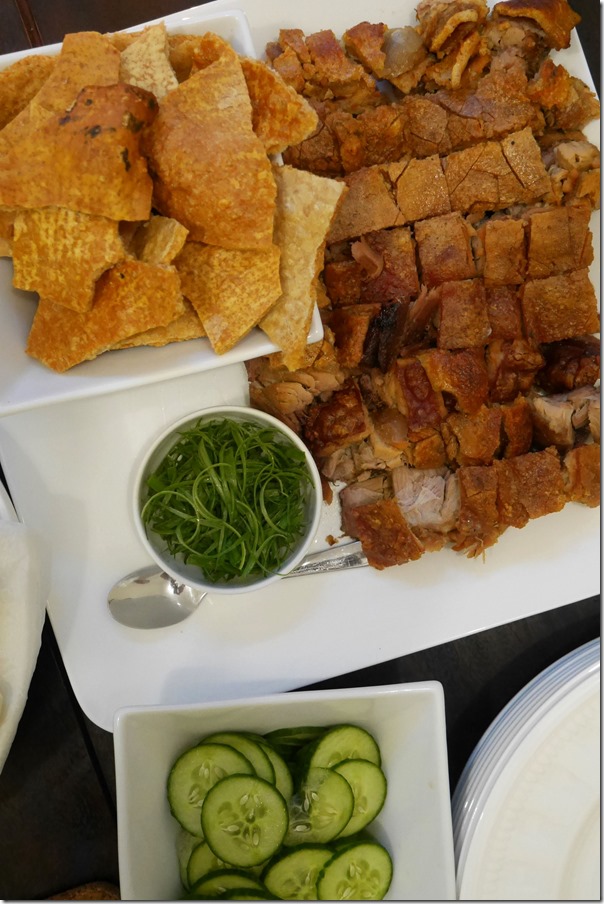
You are a GUI agent. You are given a task and a screenshot of the screen. Output one action in this format:
    pyautogui.click(x=<x>, y=<y>)
    Task: Click on the small dish
    Image resolution: width=604 pixels, height=904 pixels.
    Given the screenshot: What is the action you would take?
    pyautogui.click(x=152, y=810)